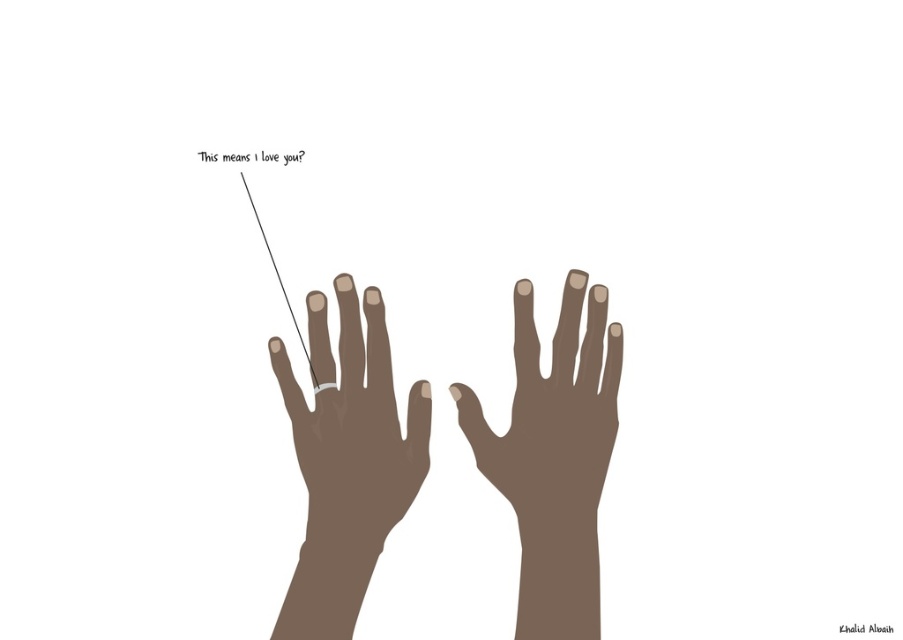
You are trying to figure out the position of the matte silver ring at left and the brown matte hand at center in the image. Which object is located to the left of the other?

The matte silver ring at left is to the left of the brown matte hand at center.

You are an assistant helping someone choose jewelry. They want to wear a matte silver ring at left and a brown matte hand at center. Based on the image, can you tell me which object is positioned lower?

The matte silver ring at left is below brown matte hand at center, so the matte silver ring at left is positioned lower.

You are designing a digital interface and need to place an icon representing love next to the point at coordinates point (355, 435). Where should you place it?

The point (355, 435) corresponds to the matte silver ring at left, so place the icon representing love next to the matte silver ring at left.